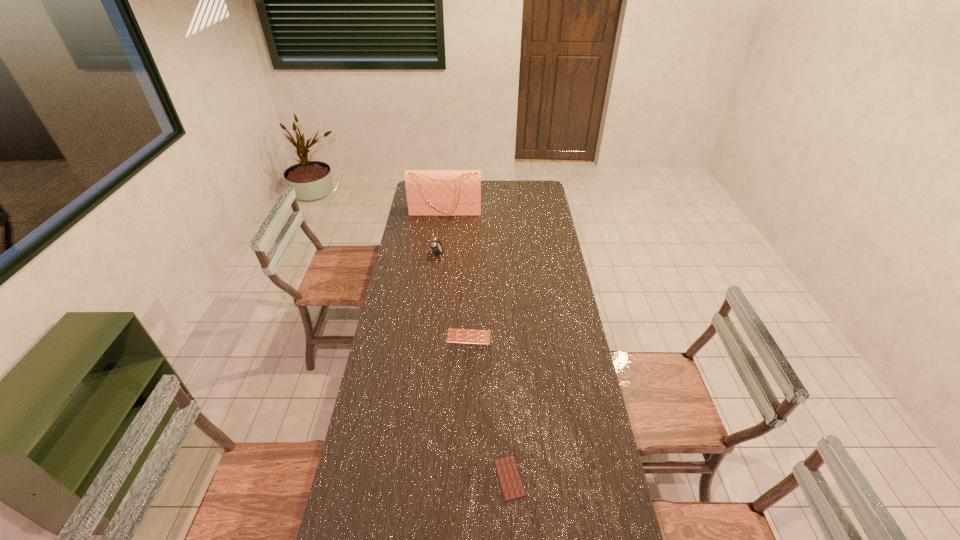
At what (x,y) coordinates should I click in order to perform the action: click on handbag. Please return your answer as a coordinate pair (x, y). Looking at the image, I should click on (429, 192).

Where is `the farthest object`? The width and height of the screenshot is (960, 540). the farthest object is located at coordinates (429, 192).

Where is `alarm clock`? Image resolution: width=960 pixels, height=540 pixels. alarm clock is located at coordinates (437, 248).

Identify the location of the third shortest object. (437, 248).

Where is `the farther chocolate bar`? The width and height of the screenshot is (960, 540). the farther chocolate bar is located at coordinates (467, 336).

What are the coordinates of `the third farthest object` in the screenshot? It's located at (467, 336).

Locate an element on the screen. Image resolution: width=960 pixels, height=540 pixels. the shorter chocolate bar is located at coordinates (509, 478).

Image resolution: width=960 pixels, height=540 pixels. In order to click on the nearest object in this screenshot , I will do `click(509, 478)`.

The image size is (960, 540). In order to click on free region located on the front-facing side of the handbag in this screenshot , I will do `click(440, 260)`.

Where is `vacant space situated on the face of the alarm clock`? This screenshot has height=540, width=960. vacant space situated on the face of the alarm clock is located at coordinates (465, 254).